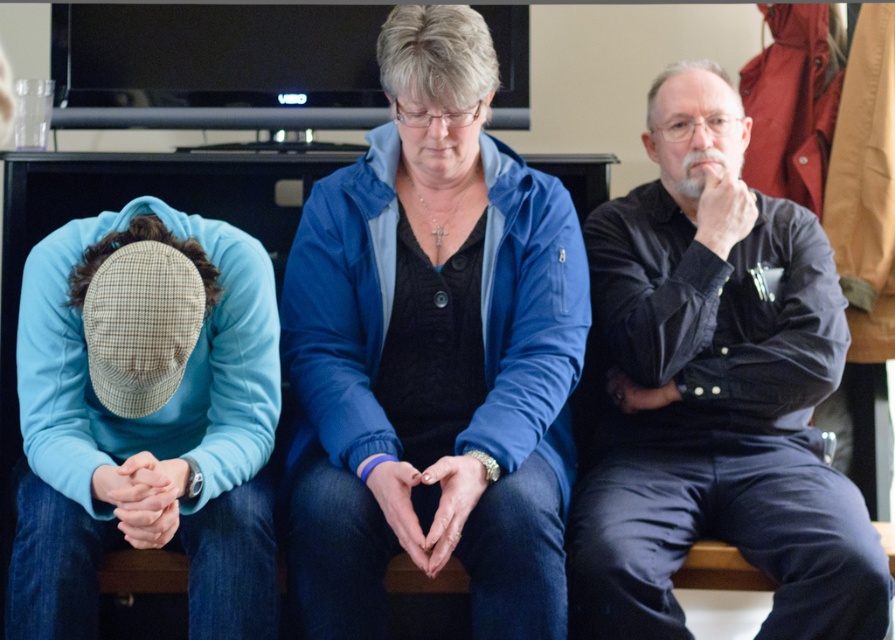
Question: Is blue fabric jacket at center thinner than light blue fleece at left?

Choices:
 (A) yes
 (B) no

Answer: (B)

Question: Does black denim shirt at right have a smaller size compared to light blue fleece at left?

Choices:
 (A) yes
 (B) no

Answer: (B)

Question: Which of the following is the farthest from the observer?

Choices:
 (A) black denim shirt at right
 (B) blue fabric jacket at center
 (C) light blue fleece at left

Answer: (A)

Question: Estimate the real-world distances between objects in this image. Which object is closer to the light blue fleece at left?

Choices:
 (A) black denim shirt at right
 (B) blue fabric jacket at center

Answer: (B)

Question: Can you confirm if blue fabric jacket at center is positioned below black denim shirt at right?

Choices:
 (A) yes
 (B) no

Answer: (B)

Question: Estimate the real-world distances between objects in this image. Which object is farther from the black denim shirt at right?

Choices:
 (A) light blue fleece at left
 (B) blue fabric jacket at center

Answer: (A)